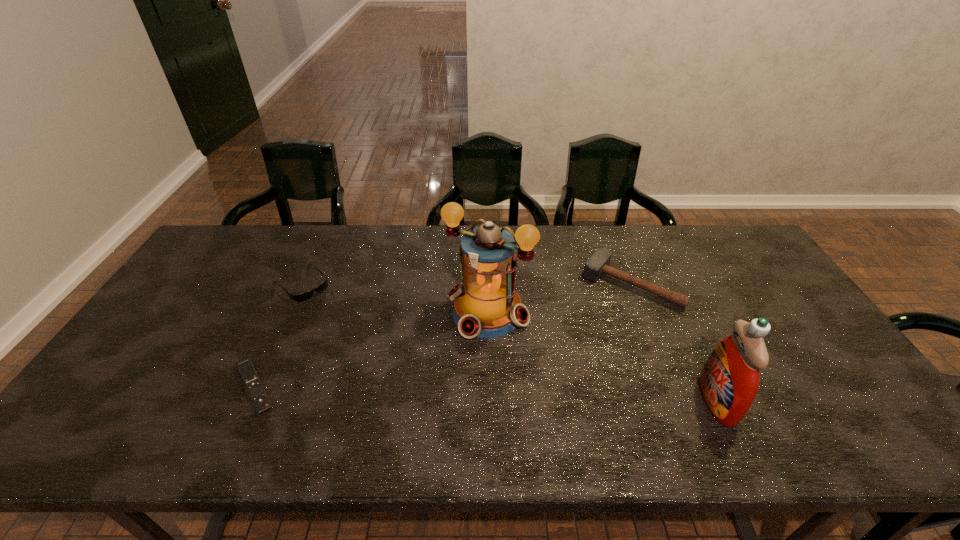
Find the location of a particular element. The height and width of the screenshot is (540, 960). vacant space on the desktop that is between the remote control and the detergent and is positioned on the front-facing side of the sunglasses is located at coordinates (416, 392).

Identify the location of free space on the desktop that is between the remote control and the detergent and is positioned on the striking surface of the third shortest object. The width and height of the screenshot is (960, 540). point(549,396).

You are a GUI agent. You are given a task and a screenshot of the screen. Output one action in this format:
    pyautogui.click(x=<x>, y=<y>)
    Task: Click on the free space on the desktop that is between the remote control and the detergent and is positioned on the front-facing side of the lantern
    
    Given the screenshot: What is the action you would take?
    pyautogui.click(x=426, y=392)